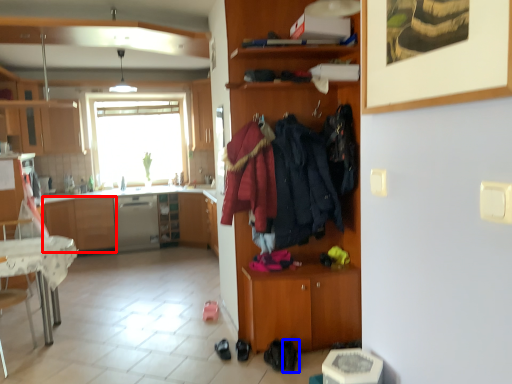
Question: Which object appears closest to the camera in this image, cabinetry (highlighted by a red box) or footwear (highlighted by a blue box)?

Choices:
 (A) cabinetry
 (B) footwear

Answer: (B)